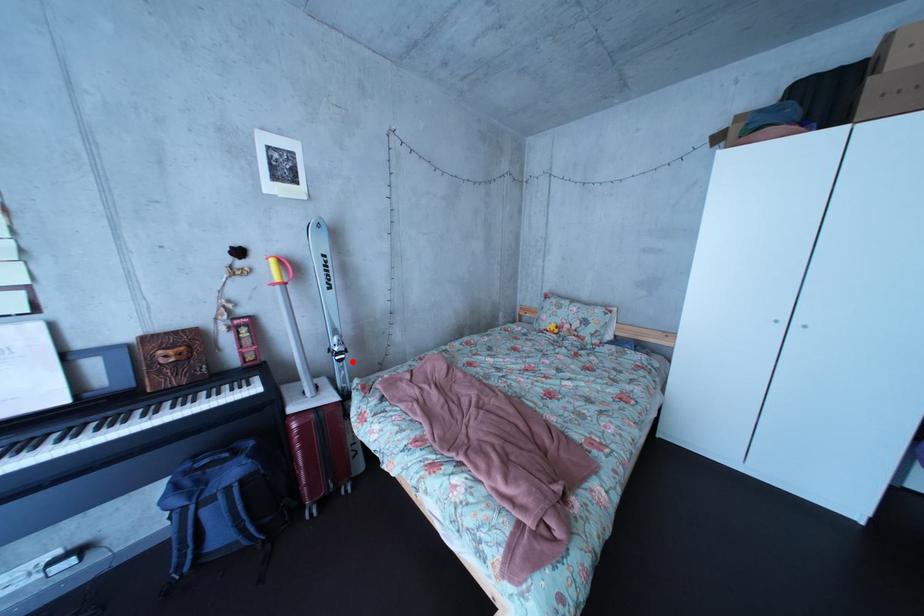
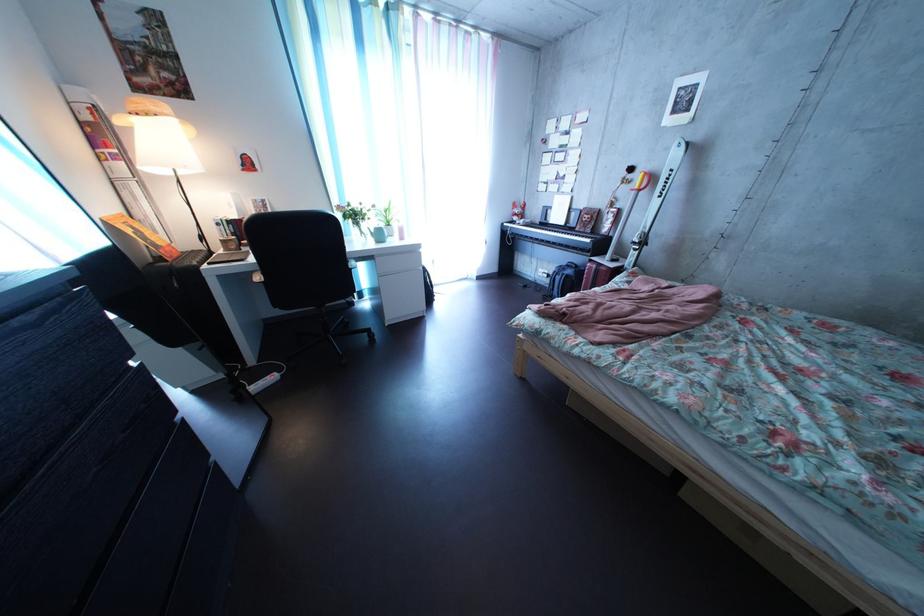
Find the pixel in the second image that matches the highlighted location in the first image.

(648, 252)